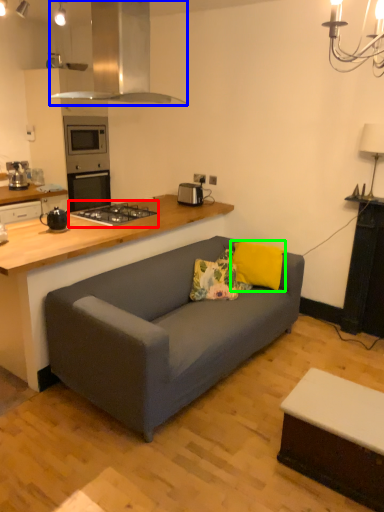
Question: Which object is the closest to the gas stove (highlighted by a red box)? Choose among these: kitchen appliance (highlighted by a blue box) or pillow (highlighted by a green box).

Choices:
 (A) kitchen appliance
 (B) pillow

Answer: (B)